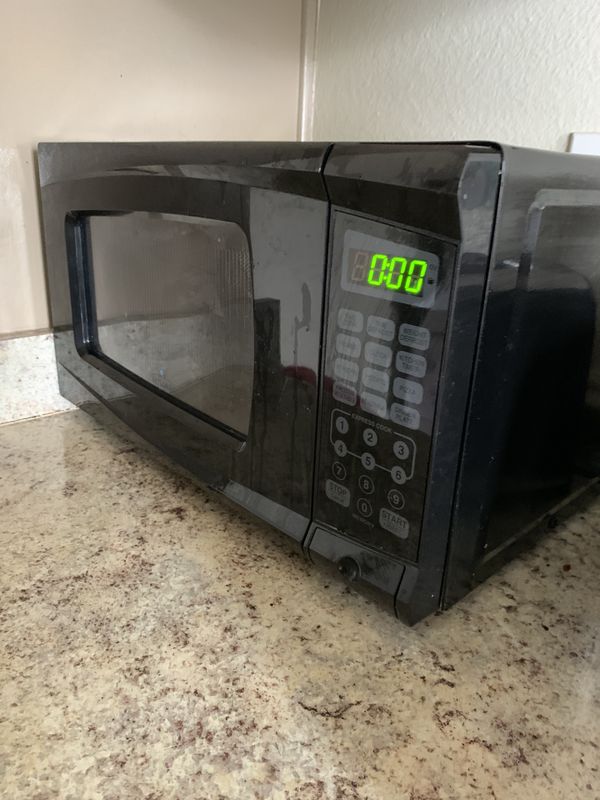
At what (x,y) coordinates should I click in order to perform the action: click on table. Please return your answer as a coordinate pair (x, y). Image resolution: width=600 pixels, height=800 pixels. Looking at the image, I should click on (303, 645).